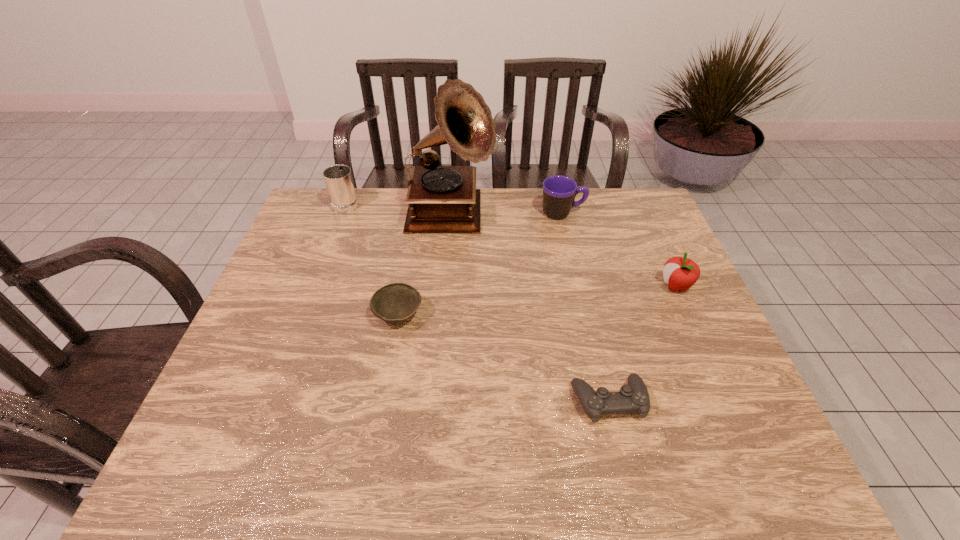
Identify the location of free region that satisfies the following two spatial constraints: 1. on the horn of the control; 2. on the right side of the record player. This screenshot has width=960, height=540. (436, 401).

This screenshot has width=960, height=540. Find the location of `vacant space that satisfies the following two spatial constraints: 1. on the horn of the record player; 2. on the right side of the apple`. vacant space that satisfies the following two spatial constraints: 1. on the horn of the record player; 2. on the right side of the apple is located at coordinates (445, 286).

Locate an element on the screen. free spot that satisfies the following two spatial constraints: 1. with the handle on the side of the rightmost object; 2. on the right side of the shorter mug is located at coordinates (579, 286).

Identify the location of free location that satisfies the following two spatial constraints: 1. with the handle on the side of the apple; 2. on the left side of the right mug. Image resolution: width=960 pixels, height=540 pixels. (579, 286).

You are a GUI agent. You are given a task and a screenshot of the screen. Output one action in this format:
    pyautogui.click(x=<x>, y=<y>)
    Task: Click on the free space that satisfies the following two spatial constraints: 1. on the horn of the record player; 2. on the left side of the nearest object
    Image resolution: width=960 pixels, height=540 pixels.
    Given the screenshot: What is the action you would take?
    pyautogui.click(x=436, y=401)

Find the location of `free space that satisfies the following two spatial constraints: 1. on the back side of the nearest object; 2. on the horn of the record player`. free space that satisfies the following two spatial constraints: 1. on the back side of the nearest object; 2. on the horn of the record player is located at coordinates (565, 217).